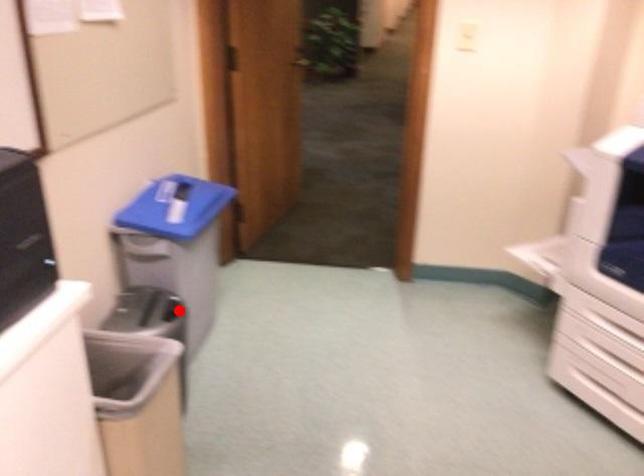
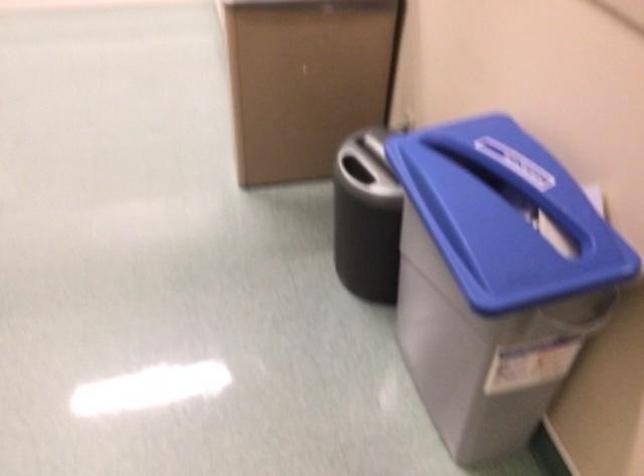
The point at the highlighted location is marked in the first image. Where is the corresponding point in the second image?

(366, 217)